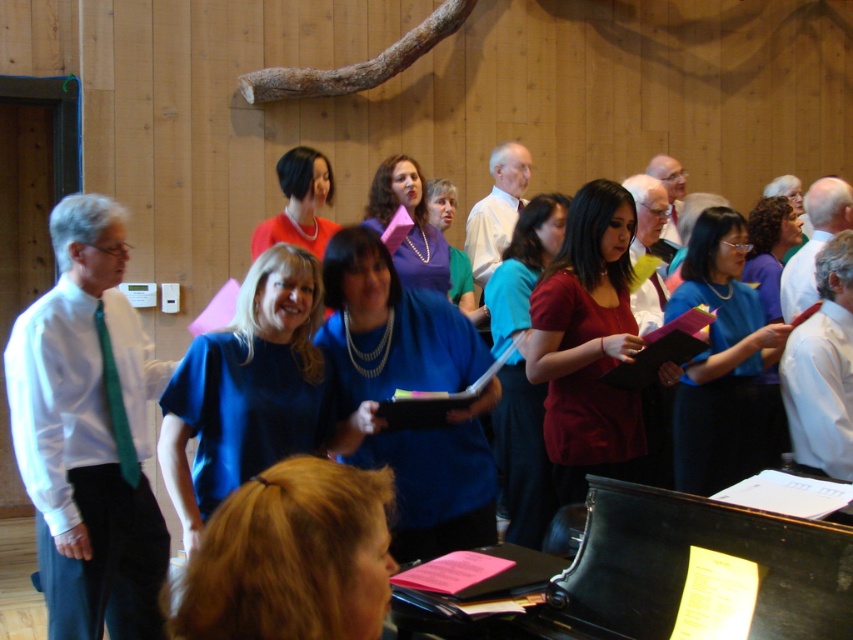
Question: Does matte blue blouse at center appear under matte blue dress at center?

Choices:
 (A) yes
 (B) no

Answer: (A)

Question: Based on their relative distances, which object is nearer to the black polished piano at lower center?

Choices:
 (A) blue fabric shirt at center
 (B) blue fabric folder at center
 (C) matte blue blouse at center
 (D) matte blue dress at center

Answer: (B)

Question: Which object is closer to the camera taking this photo?

Choices:
 (A) matte blue blouse at center
 (B) matte red shirt at center

Answer: (B)

Question: Which point is farther from the camera taking this photo?

Choices:
 (A) (335, 260)
 (B) (505, 384)

Answer: (B)

Question: Can you confirm if blue matte shirt at center is thinner than matte red shirt at center?

Choices:
 (A) no
 (B) yes

Answer: (B)

Question: Can you confirm if blue fabric folder at center is smaller than blue fabric shirt at center?

Choices:
 (A) no
 (B) yes

Answer: (B)